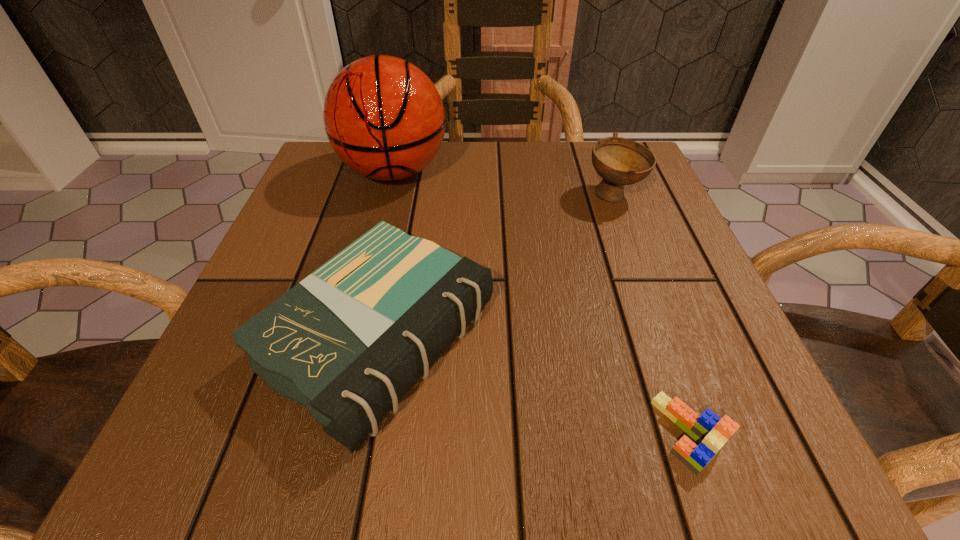
This screenshot has height=540, width=960. I want to click on vacant region that satisfies the following two spatial constraints: 1. on the back side of the Lego; 2. on the left side of the soup bowl, so click(x=606, y=195).

I want to click on blank area in the image that satisfies the following two spatial constraints: 1. on the side with spill of the second shortest object; 2. on the left side of the basketball, so click(x=351, y=338).

I want to click on vacant space that satisfies the following two spatial constraints: 1. on the side with spill of the tallest object; 2. on the right side of the Lego, so click(x=327, y=433).